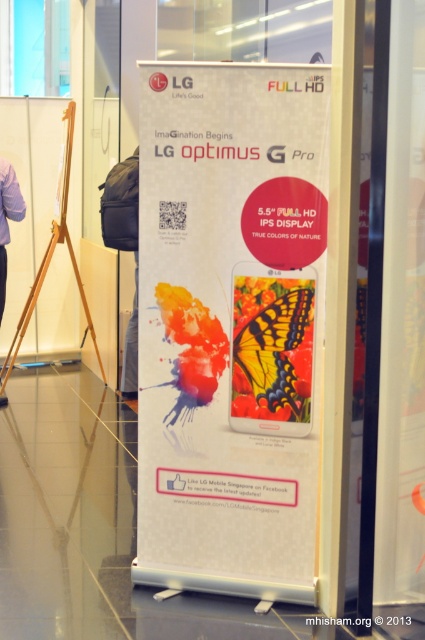
Question: Does yellow matte butterfly at center appear under purple fabric at left?

Choices:
 (A) yes
 (B) no

Answer: (A)

Question: Which object appears closest to the camera in this image?

Choices:
 (A) white paper poster at center
 (B) wooden tripod at left
 (C) purple fabric at left

Answer: (A)

Question: Does yellow matte butterfly at center appear on the left side of purple fabric at left?

Choices:
 (A) no
 (B) yes

Answer: (A)

Question: Is white paper poster at center to the left of wooden tripod at left from the viewer's perspective?

Choices:
 (A) yes
 (B) no

Answer: (B)

Question: Which point is farther to the camera?

Choices:
 (A) (303, 356)
 (B) (201, 449)

Answer: (B)

Question: Which of the following is the farthest from the observer?

Choices:
 (A) (269, 372)
 (B) (2, 380)

Answer: (B)